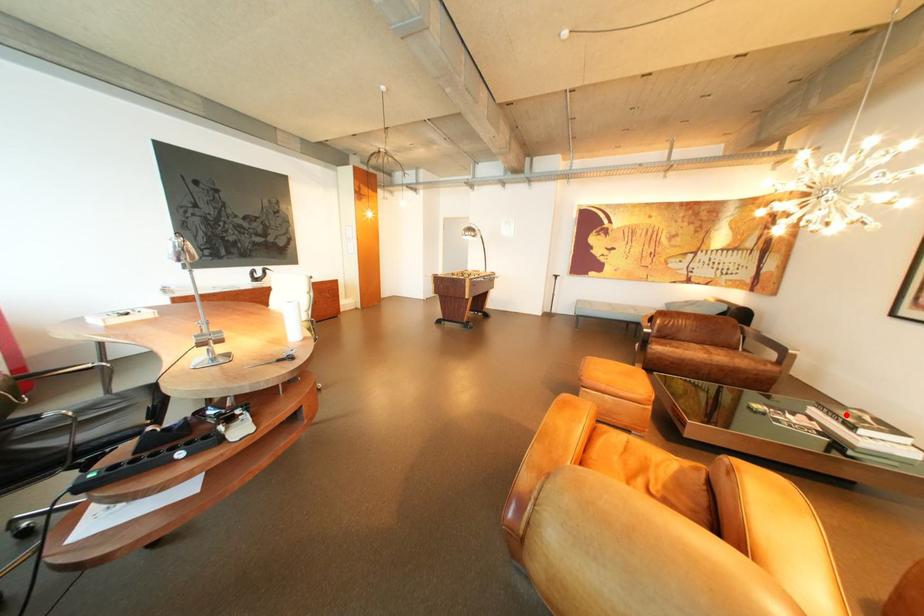
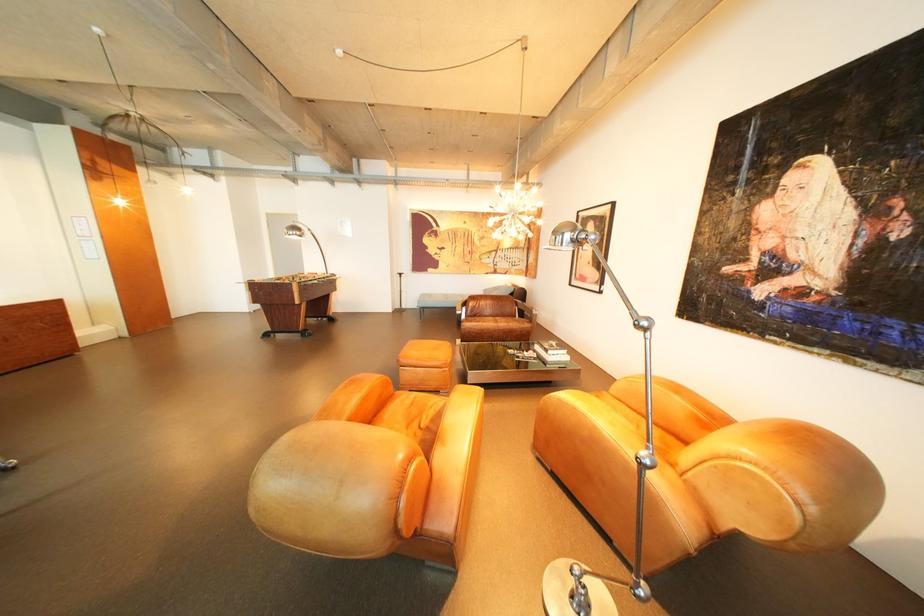
Question: I am providing you with two images of the same scene from different viewpoints. In image1, a red point is highlighted. Considering the same 3D point in image2, which of the following is correct?

Choices:
 (A) It is closer
 (B) It is farther

Answer: (A)